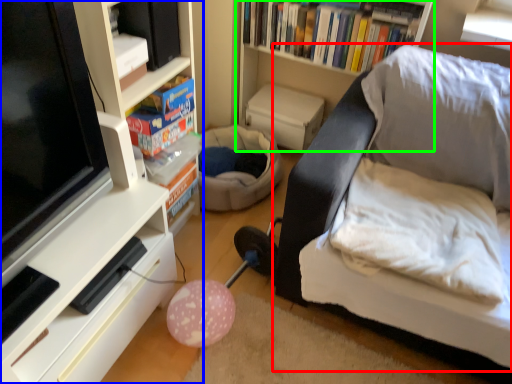
Question: Which object is positioned closest to studio couch (highlighted by a red box)? Select from shelf (highlighted by a blue box) and bookshelf (highlighted by a green box).

Choices:
 (A) shelf
 (B) bookshelf

Answer: (B)